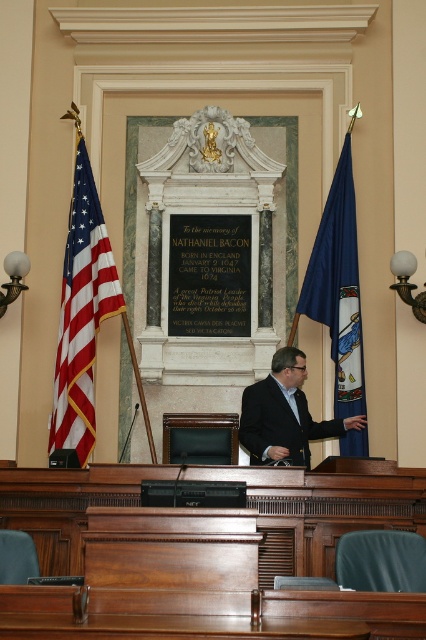
Question: Can you confirm if american flag at left is positioned to the right of dark suit at center?

Choices:
 (A) no
 (B) yes

Answer: (A)

Question: Can you confirm if american flag at left is positioned below dark suit at center?

Choices:
 (A) no
 (B) yes

Answer: (A)

Question: Which object is closer to the camera taking this photo?

Choices:
 (A) blue fabric flag at right
 (B) dark suit at center

Answer: (B)

Question: Is american flag at left behind blue fabric flag at right?

Choices:
 (A) yes
 (B) no

Answer: (A)

Question: Which of the following is the farthest from the observer?

Choices:
 (A) (267, 388)
 (B) (85, 161)
 (C) (342, 248)

Answer: (B)

Question: Which object appears closest to the camera in this image?

Choices:
 (A) dark suit at center
 (B) blue fabric flag at right
 (C) american flag at left

Answer: (A)